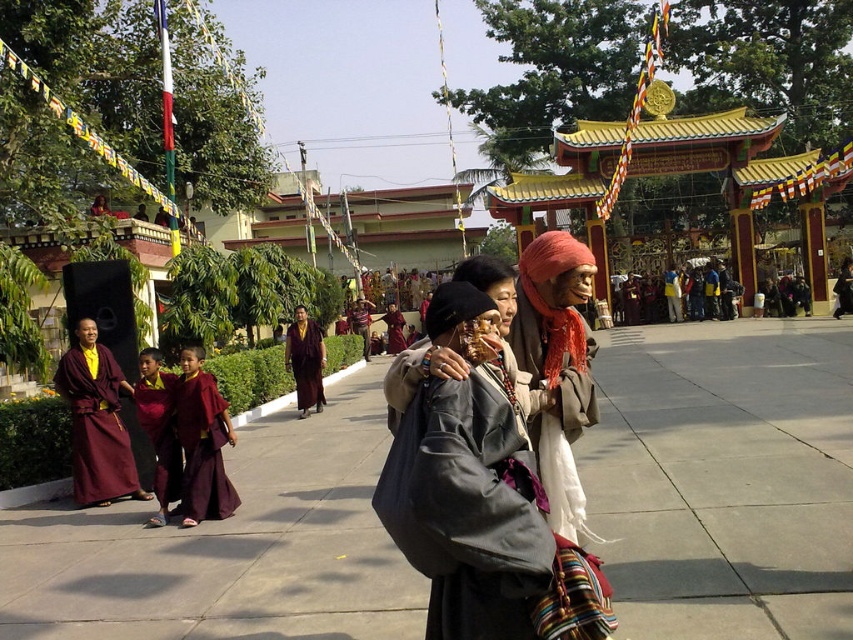
Question: Which point is closer to the camera?

Choices:
 (A) (466, 529)
 (B) (172, 449)

Answer: (A)

Question: Which point is closer to the camera?

Choices:
 (A) gray woolen robe at center
 (B) white cotton robe at center

Answer: (A)

Question: Which point is closer to the camera?

Choices:
 (A) [503, 433]
 (B) [213, 401]

Answer: (A)

Question: Is maroon silk robe at lower left bigger than maroon silk robe at center?

Choices:
 (A) no
 (B) yes

Answer: (A)

Question: Can you confirm if gray woolen robe at center is positioned to the left of maroon silk robe at left?

Choices:
 (A) yes
 (B) no

Answer: (B)

Question: Can you confirm if maroon silk robe at left is bigger than maroon silk robe at center?

Choices:
 (A) no
 (B) yes

Answer: (A)